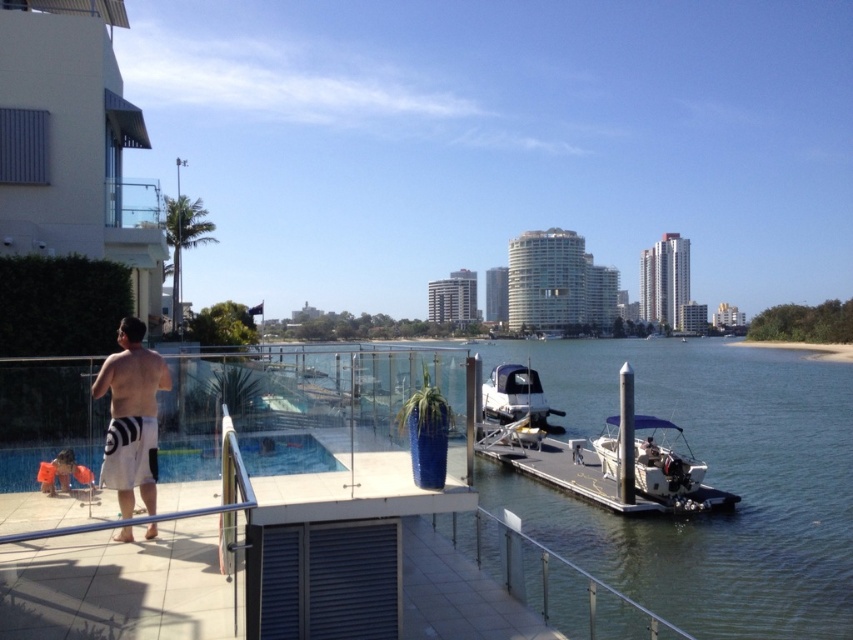
You are standing on the deck and want to move from the man to the blue vase. Which point, point (97, 371) or point (200, 467), is closer to you as you start moving?

Point (97, 371) is closer to the viewer than point (200, 467), so you should start moving towards point (97, 371) first.

You are a guest at this waterfront residence and want to avoid getting your new shoes wet. The transparent glass pool at lower left is in your path. Can you walk around the white cotton shorts at lower left to stay dry?

The white cotton shorts at lower left is 4.40 feet away from the transparent glass pool at lower left. Since the distance is sufficient, you can walk around the white cotton shorts at lower left and avoid stepping into the pool.

You are planning to host a small gathering and need to decide where to place a 1.5 meter wide table. Given the transparent glass pool at lower left and the white matte boat at center, which location has enough space for the table?

The white matte boat at center has a greater width than the transparent glass pool at lower left. Since the table is 1.5 meters wide, the white matte boat at center likely provides sufficient space, while the transparent glass pool at lower left may be too narrow.